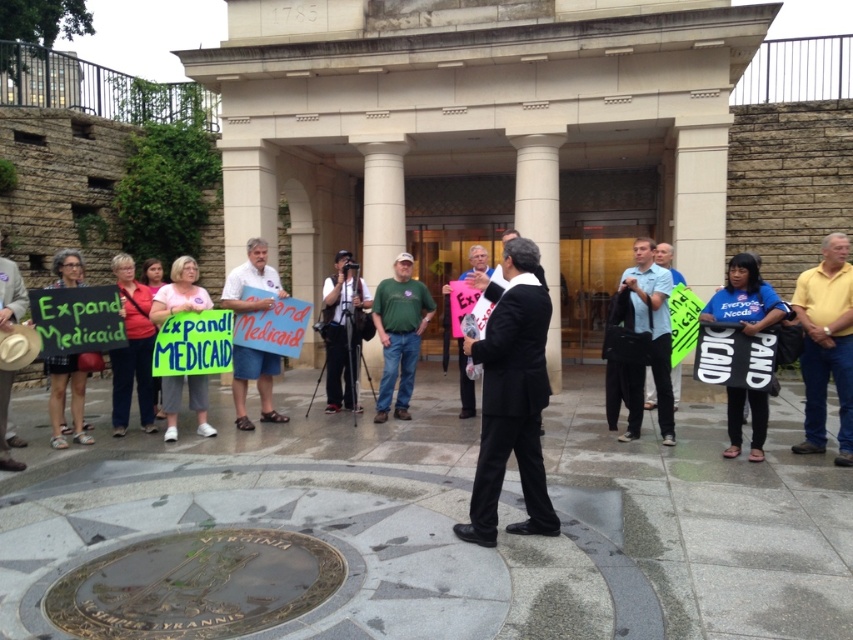
Question: Is green cotton shirt at center to the right of pink paper sign at center from the viewer's perspective?

Choices:
 (A) no
 (B) yes

Answer: (A)

Question: Is the position of yellow cotton shirt at right less distant than that of green cotton shirt at center?

Choices:
 (A) no
 (B) yes

Answer: (B)

Question: Among these points, which one is nearest to the camera?

Choices:
 (A) (383, 387)
 (B) (679, 397)
 (C) (267, 394)

Answer: (C)

Question: Which point is farther from the camera taking this photo?

Choices:
 (A) (820, 307)
 (B) (241, 285)
 (C) (634, 244)
 (D) (387, 387)

Answer: (C)

Question: Does green cotton shirt at center lie in front of pink paper sign at center?

Choices:
 (A) no
 (B) yes

Answer: (B)

Question: Which of these objects is positioned farthest from the blue fabric shirt at center?

Choices:
 (A) blue denim shorts at center
 (B) black suit at center
 (C) green cotton shirt at center
 (D) green plastic sign at center

Answer: (A)